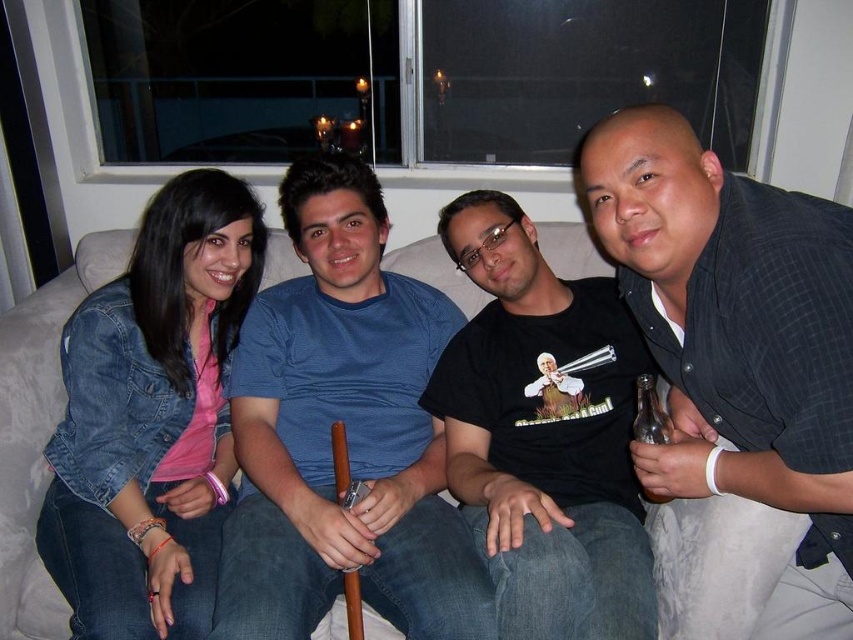
Question: Is blue cotton shirt at center above dark gray checkered shirt at right?

Choices:
 (A) no
 (B) yes

Answer: (A)

Question: In this image, where is blue cotton shirt at center located relative to white fabric couch at center?

Choices:
 (A) below
 (B) above

Answer: (B)

Question: Does blue cotton shirt at center appear over white fabric couch at center?

Choices:
 (A) no
 (B) yes

Answer: (B)

Question: Which point is farther to the camera?

Choices:
 (A) (315, 432)
 (B) (608, 198)
 (C) (15, 536)
 (D) (624, 424)

Answer: (A)

Question: Which of the following is the farthest from the observer?

Choices:
 (A) (492, 552)
 (B) (799, 625)
 (C) (6, 596)

Answer: (C)

Question: Which point appears closest to the camera in this image?

Choices:
 (A) (90, 273)
 (B) (665, 355)
 (C) (444, 429)
 (D) (392, 448)

Answer: (B)